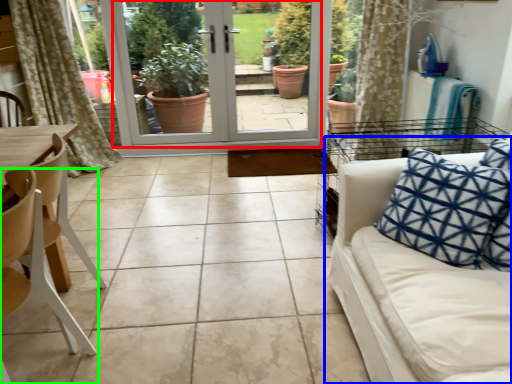
Question: Based on their relative distances, which object is nearer to screen door (highlighted by a red box)? Choose from studio couch (highlighted by a blue box) and chair (highlighted by a green box).

Choices:
 (A) studio couch
 (B) chair

Answer: (A)